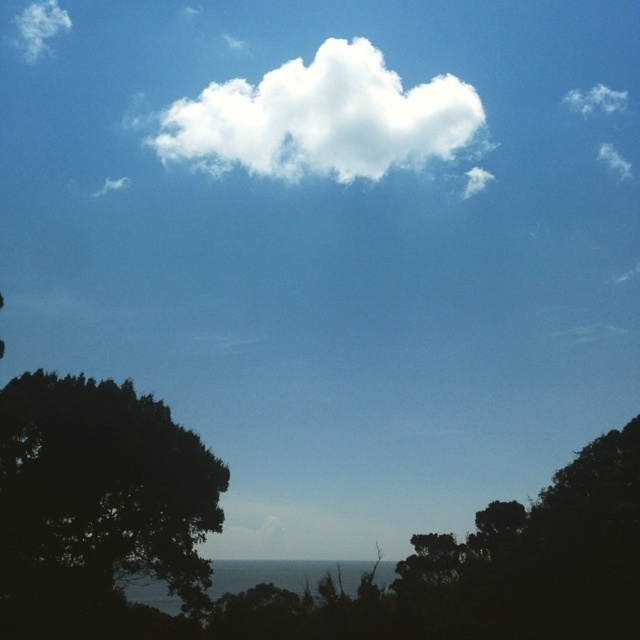
Question: Which point is closer to the camera?

Choices:
 (A) white fluffy cloud at upper left
 (B) white fluffy cloud at upper center
 (C) white fluffy cloud at upper right
 (D) dark green leafy tree at lower left

Answer: (D)

Question: Can you confirm if dark green leafy tree at lower left is positioned to the right of white fluffy cloud at upper right?

Choices:
 (A) no
 (B) yes

Answer: (A)

Question: Does dark green leafy tree at lower left appear over white fluffy cloud at upper center?

Choices:
 (A) yes
 (B) no

Answer: (B)

Question: Which point is farther to the camera?

Choices:
 (A) white fluffy cloud at upper right
 (B) dark green leafy tree at lower left

Answer: (A)

Question: Does white fluffy cloud at upper center appear over white fluffy cloud at upper right?

Choices:
 (A) no
 (B) yes

Answer: (A)

Question: Which object is closer to the camera taking this photo?

Choices:
 (A) white fluffy cloud at upper center
 (B) white fluffy cloud at upper right
 (C) white fluffy cloud at upper left
 (D) dark green leafy tree at lower left

Answer: (D)